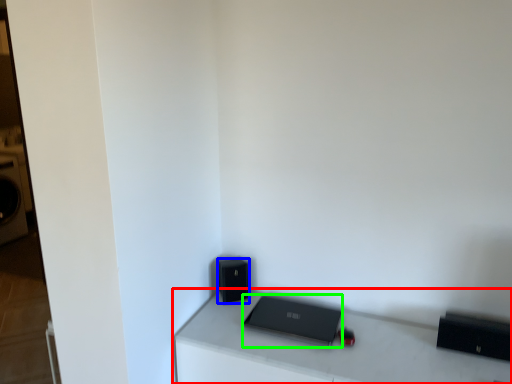
Question: Considering the real-world distances, which object is closest to furniture (highlighted by a red box)? speaker (highlighted by a blue box) or laptop (highlighted by a green box).

Choices:
 (A) speaker
 (B) laptop

Answer: (B)